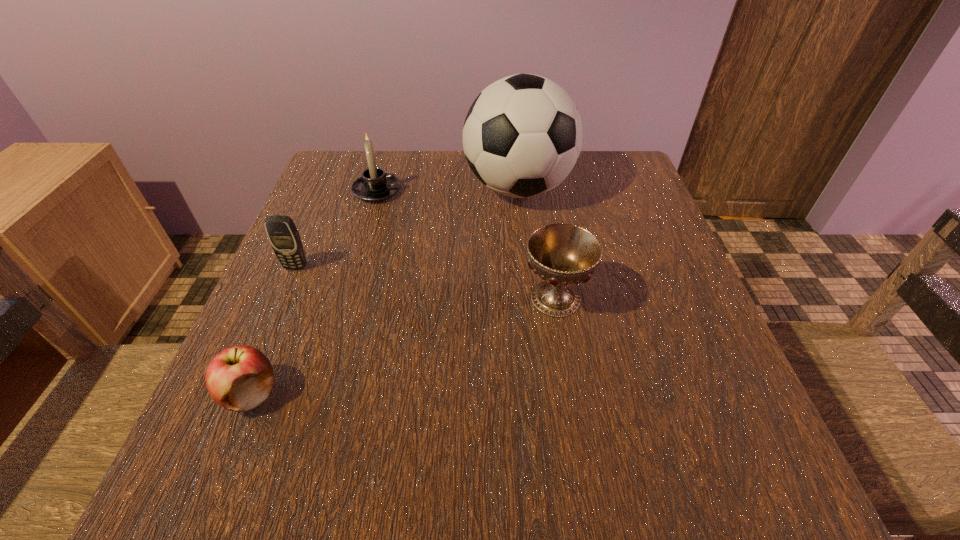
Locate an element on the screen. The image size is (960, 540). the tallest object is located at coordinates (522, 136).

Locate an element on the screen. candle holder is located at coordinates tap(374, 185).

The image size is (960, 540). In order to click on the third object from right to left in this screenshot , I will do `click(374, 185)`.

Identify the location of the fourth farthest object. (563, 255).

The width and height of the screenshot is (960, 540). I want to click on the third nearest object, so click(283, 235).

Locate an element on the screen. The height and width of the screenshot is (540, 960). the nearest object is located at coordinates (240, 378).

This screenshot has height=540, width=960. I want to click on the shortest object, so click(240, 378).

Where is `vacant space located 0.120m on the right of the soccer ball`? vacant space located 0.120m on the right of the soccer ball is located at coordinates (622, 188).

The height and width of the screenshot is (540, 960). Find the location of `vacant region located with a handle on the side of the second tallest object`. vacant region located with a handle on the side of the second tallest object is located at coordinates (468, 191).

The image size is (960, 540). Identify the location of vacant space situated on the back of the second nearest object. [x=542, y=215].